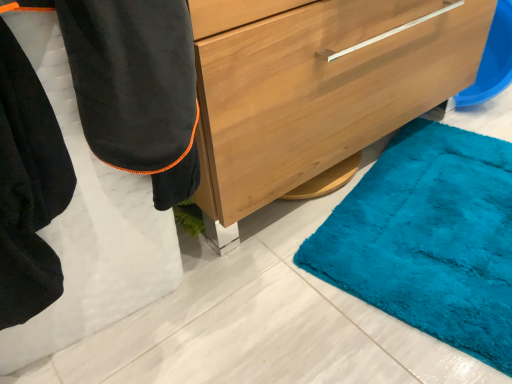
Question: From the image's perspective, is black fleece robe at lower left positioned above or below wooden chest of drawers at center?

Choices:
 (A) above
 (B) below

Answer: (B)

Question: Is black fleece robe at lower left in front of or behind wooden chest of drawers at center in the image?

Choices:
 (A) front
 (B) behind

Answer: (A)

Question: From a real-world perspective, is black fleece robe at lower left physically located above or below wooden chest of drawers at center?

Choices:
 (A) above
 (B) below

Answer: (A)

Question: In terms of height, does wooden chest of drawers at center look taller or shorter compared to black fleece robe at lower left?

Choices:
 (A) tall
 (B) short

Answer: (B)

Question: Visually, is wooden chest of drawers at center positioned to the left or to the right of black fleece robe at lower left?

Choices:
 (A) right
 (B) left

Answer: (A)

Question: In terms of width, does wooden chest of drawers at center look wider or thinner when compared to black fleece robe at lower left?

Choices:
 (A) wide
 (B) thin

Answer: (B)

Question: From the image's perspective, is wooden chest of drawers at center positioned above or below black fleece robe at lower left?

Choices:
 (A) above
 (B) below

Answer: (A)